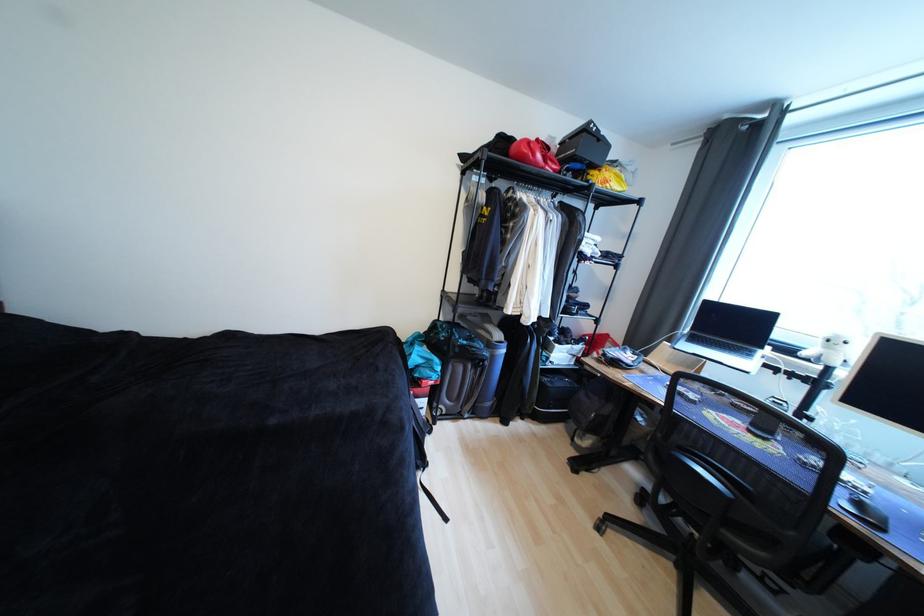
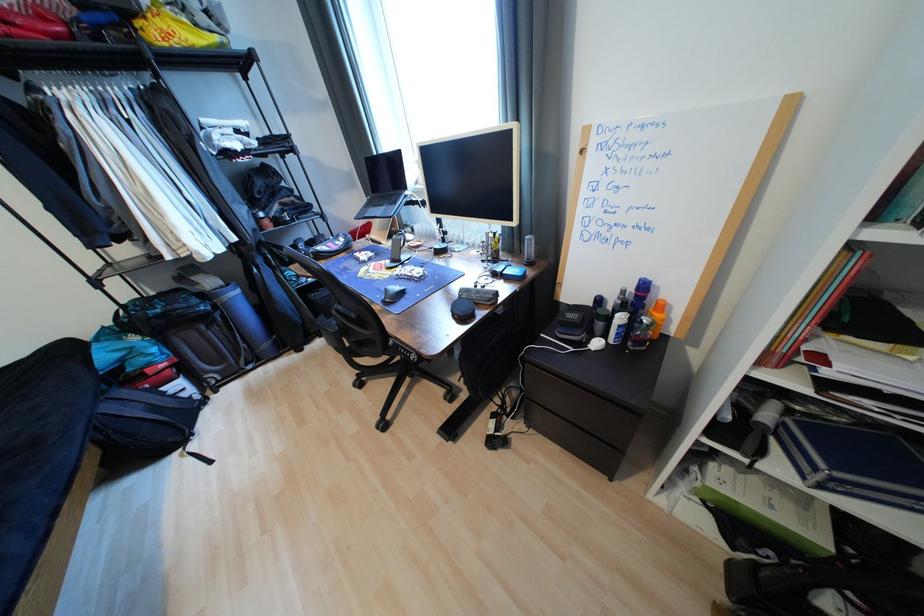
Locate, in the second image, the point that corresponds to point (631, 188) in the first image.

(223, 39)